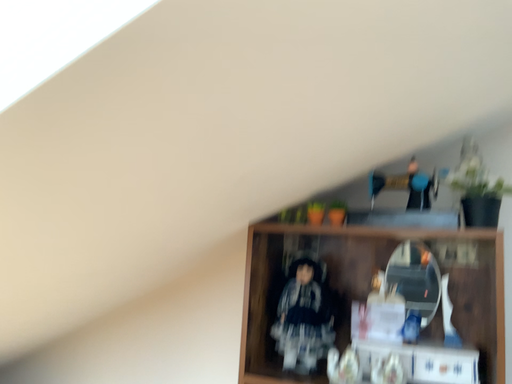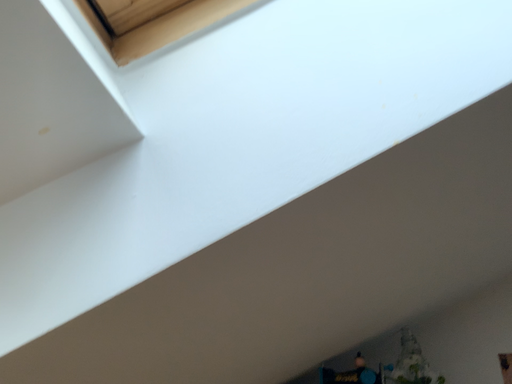
Question: How did the camera likely rotate when shooting the video?

Choices:
 (A) rotated upward
 (B) rotated downward

Answer: (A)